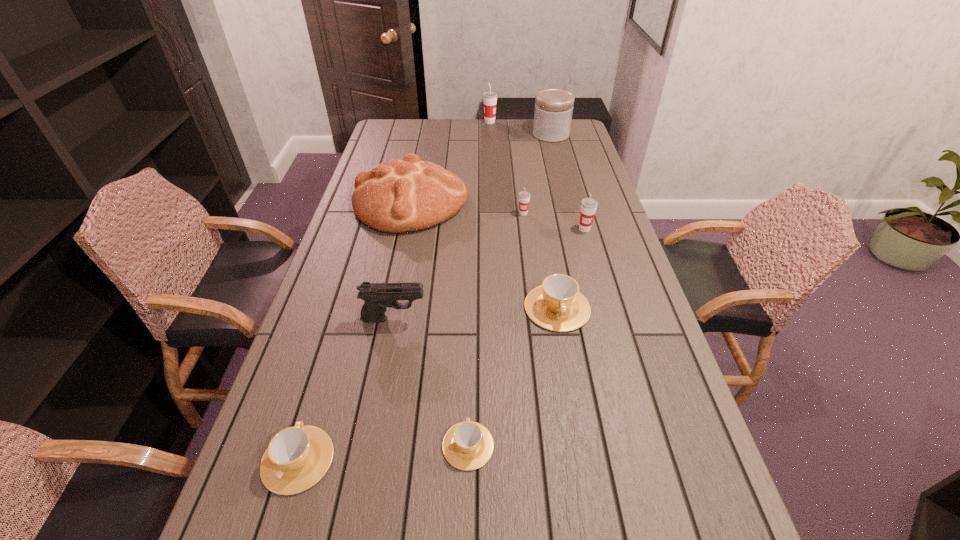
Where is `vacant space situated on the side of the second smallest red cup with the logo`? This screenshot has height=540, width=960. vacant space situated on the side of the second smallest red cup with the logo is located at coordinates (605, 299).

Locate an element on the screen. Image resolution: width=960 pixels, height=540 pixels. vacant region located at the barrel of the black pistol is located at coordinates point(561,319).

Locate an element on the screen. vacant space located 0.120m on the side of the second farthest cup with the logo is located at coordinates (x=526, y=238).

Where is `vacant position located 0.260m with the handle on the side of the biggest brown cup`? The width and height of the screenshot is (960, 540). vacant position located 0.260m with the handle on the side of the biggest brown cup is located at coordinates coord(578,426).

The height and width of the screenshot is (540, 960). I want to click on vacant space located 0.170m with the handle on the side of the second shortest object, so click(327, 362).

Locate an element on the screen. This screenshot has height=540, width=960. vacant space situated with the handle on the side of the second shortest object is located at coordinates (324, 373).

At what (x,y) coordinates should I click in order to perform the action: click on free location located 0.120m with the handle on the side of the second shortest object. Please return your answer as a coordinate pair (x, y). The height and width of the screenshot is (540, 960). Looking at the image, I should click on (323, 380).

Where is `free point located with the handle on the side of the shortest cup`? This screenshot has width=960, height=540. free point located with the handle on the side of the shortest cup is located at coordinates (470, 334).

Identify the location of vacant space located 0.330m with the handle on the side of the shortest cup. This screenshot has height=540, width=960. (470, 311).

Where is `vacant space located 0.090m with the handle on the side of the shortest cup`? vacant space located 0.090m with the handle on the side of the shortest cup is located at coordinates (469, 387).